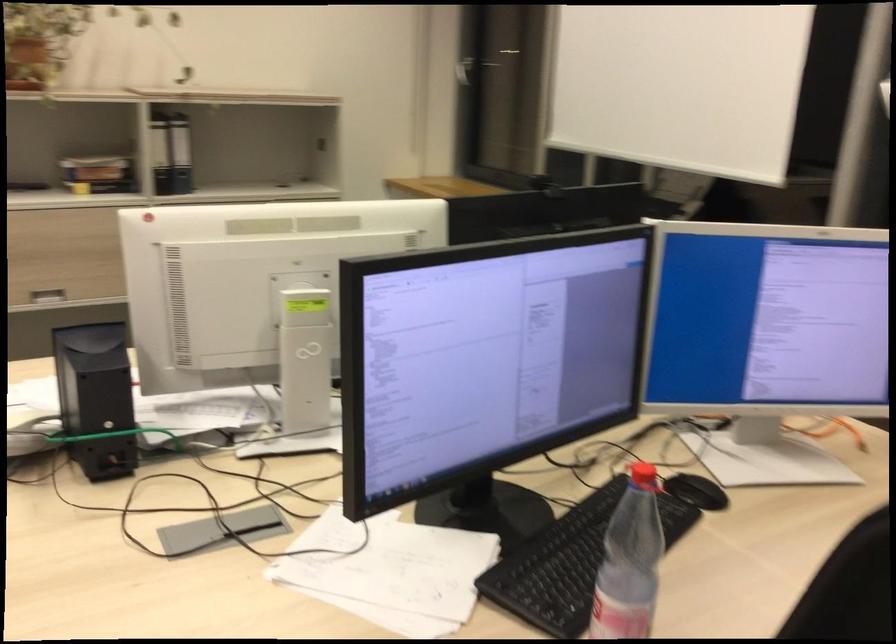
Where would you lift the black speaker? Please return your answer as a coordinate pair (x, y).

(96, 397)